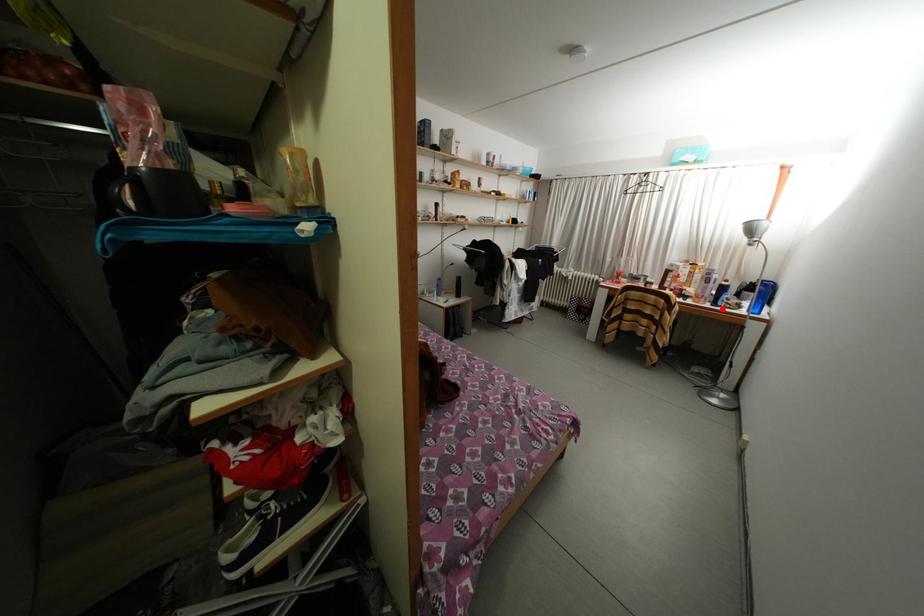
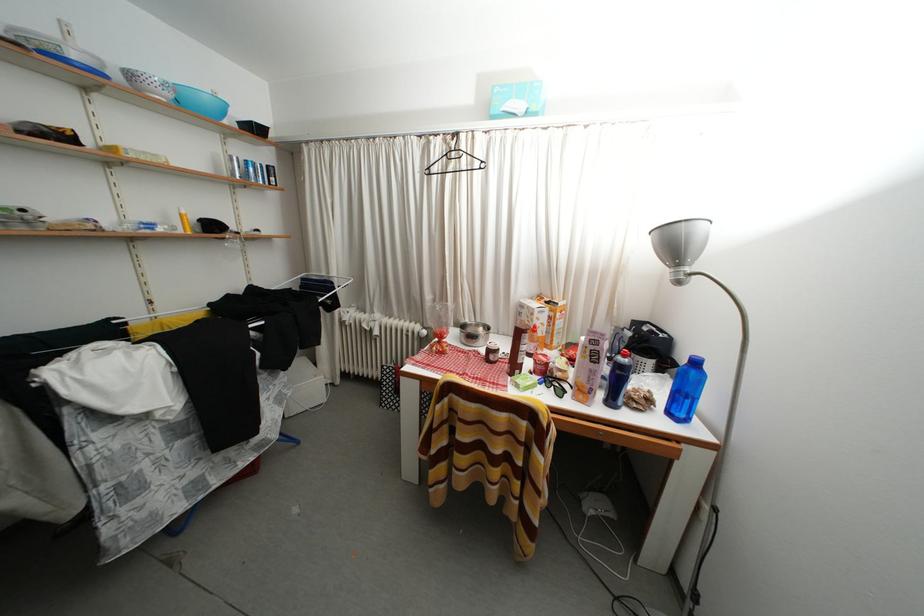
Question: I am providing you with two images of the same scene from different viewpoints. A red point is shown in image1. For the corresponding object point in image2, is it positioned nearer or farther from the camera?

Choices:
 (A) Nearer
 (B) Farther

Answer: (B)